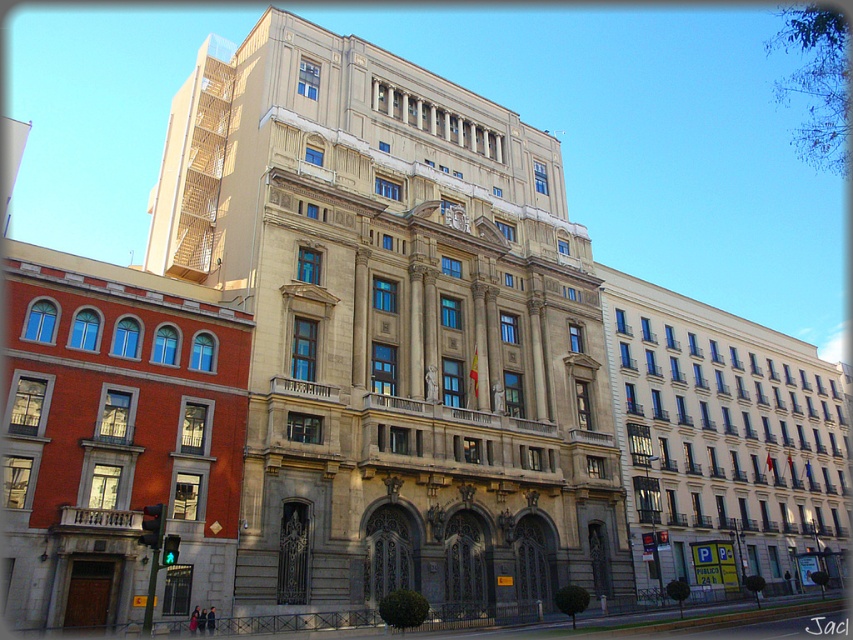
You are standing at a point 78 meters away from the point marked at coordinates point (549, 163). Given the grand building in front of you, can you estimate how far you are from the main entrance of the building?

The point marked at coordinates point (549, 163) is 78.00 meters away from you. Since the main entrance is likely near this central section with the balcony and statues, you are approximately 78 meters away from the main entrance.

Based on the photo, you are standing at the coordinates point 0.5, 0.46 in the image. Which direction should you move to reach the beige stone building at center?

Since the beige stone building at center is located at point [393,328], you should move slightly to the right and upwards from your current position at [392,320] to reach it.

You are standing at the point marked as point (393, 328) in the image. Which building are you facing? Please choose from the beige stone building at center and the red building on the left.

You are facing the beige stone building at center because the beige stone building at center is located at point (393, 328).